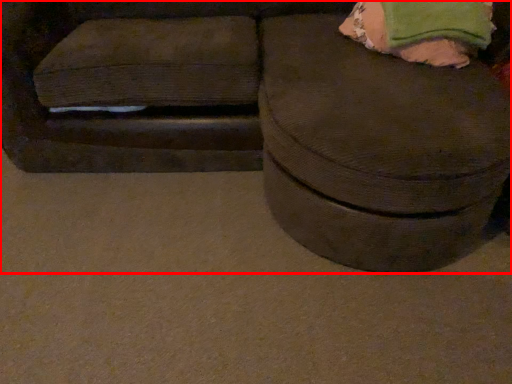
Question: From the image's perspective, considering the relative positions of furniture (annotated by the red box) and bean bag chair in the image provided, where is furniture (annotated by the red box) located with respect to the staircase?

Choices:
 (A) above
 (B) below

Answer: (B)